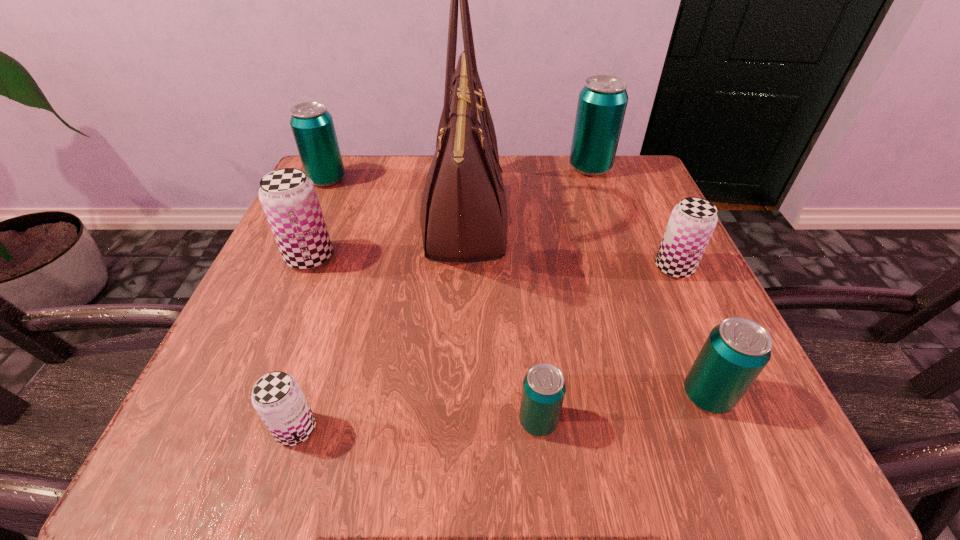
The height and width of the screenshot is (540, 960). I want to click on the sixth closest beer can to the smallest teal beer can, so click(x=312, y=125).

Point out which teal beer can is positioned as the nearest to the rightmost purple beer can. Please provide its 2D coordinates. Your answer should be formatted as a tuple, i.e. [(x, y)], where the tuple contains the x and y coordinates of a point satisfying the conditions above.

[(736, 351)]

Where is `the third closest teal beer can to the handbag`? Image resolution: width=960 pixels, height=540 pixels. the third closest teal beer can to the handbag is located at coordinates (312, 125).

Locate which purple beer can is the closest to the biggest purple beer can. Please provide its 2D coordinates. Your answer should be formatted as a tuple, i.e. [(x, y)], where the tuple contains the x and y coordinates of a point satisfying the conditions above.

[(277, 397)]

What are the coordinates of `purple beer can that is the second closest to the leftmost teal beer can` in the screenshot? It's located at (277, 397).

The width and height of the screenshot is (960, 540). In order to click on vacant space that satisfies the following two spatial constraints: 1. on the front side of the leftmost purple beer can; 2. on the left side of the leftmost teal beer can in this screenshot , I will do `click(291, 257)`.

Locate an element on the screen. The height and width of the screenshot is (540, 960). free location that satisfies the following two spatial constraints: 1. on the back side of the third biggest teal beer can; 2. on the right side of the second purple beer can from left to right is located at coordinates (307, 395).

Locate an element on the screen. vacant region that satisfies the following two spatial constraints: 1. on the front-facing side of the second smallest purple beer can; 2. on the right side of the handbag is located at coordinates (463, 268).